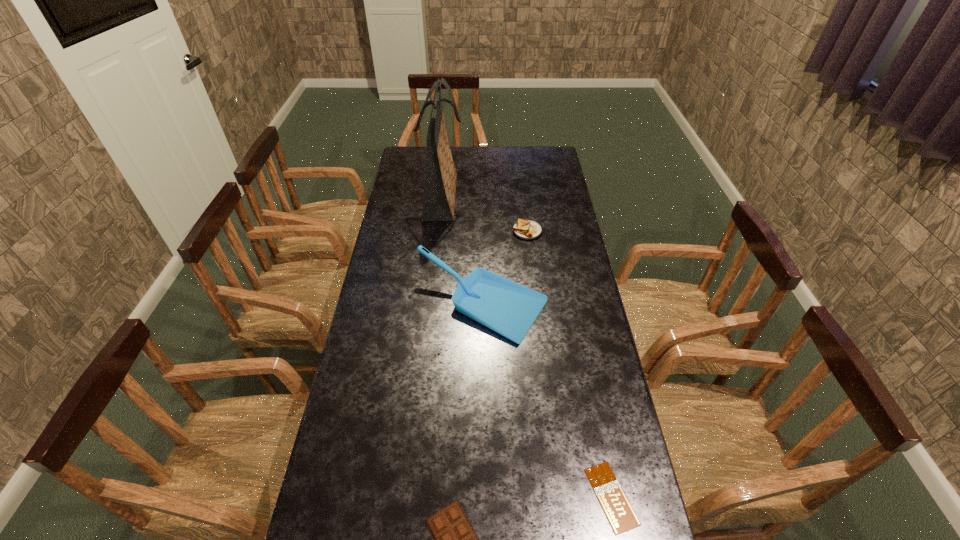
What are the coordinates of `free space located 0.380m on the front of the third shortest object` in the screenshot? It's located at (537, 314).

Locate an element on the screen. The width and height of the screenshot is (960, 540). free space located 0.150m on the back of the right chocolate bar is located at coordinates (593, 408).

Locate an element on the screen. Image resolution: width=960 pixels, height=540 pixels. object located in the left edge section of the desktop is located at coordinates (440, 185).

This screenshot has width=960, height=540. Find the location of `dustpan that is at the right edge`. dustpan that is at the right edge is located at coordinates (506, 307).

The image size is (960, 540). Identify the location of sandwich located in the right edge section of the desktop. (525, 229).

Find the location of a particular element. This screenshot has height=540, width=960. chocolate bar at the right edge is located at coordinates (615, 504).

Find the location of `vacant area at the far edge of the desktop`. vacant area at the far edge of the desktop is located at coordinates (493, 154).

Identify the location of vacant space at the left edge of the desktop. (380, 300).

The width and height of the screenshot is (960, 540). I want to click on vacant area at the right edge of the desktop, so click(531, 190).

This screenshot has height=540, width=960. I want to click on vacant space in between the second tallest object and the farthest object, so click(x=462, y=251).